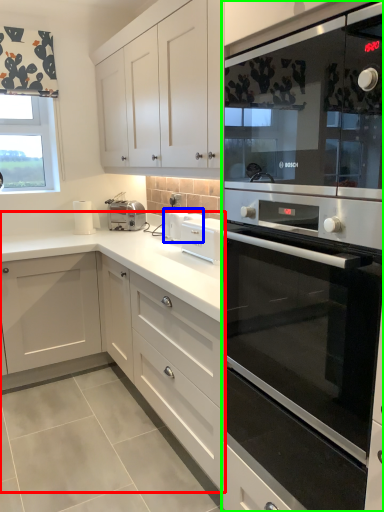
Question: Considering the real-world distances, which object is farthest from cabinetry (highlighted by a red box)? appliance (highlighted by a blue box) or home appliance (highlighted by a green box)?

Choices:
 (A) appliance
 (B) home appliance

Answer: (B)